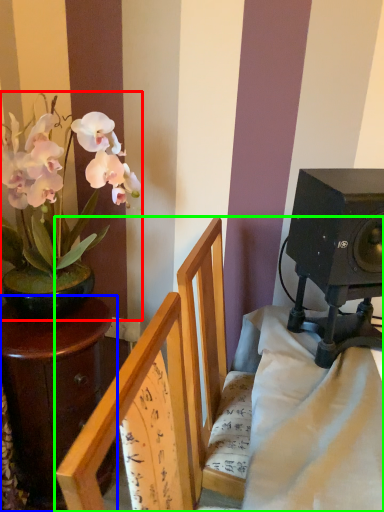
Question: Which is nearer to the houseplant (highlighted by a red box)? table (highlighted by a blue box) or furniture (highlighted by a green box).

Choices:
 (A) table
 (B) furniture

Answer: (A)